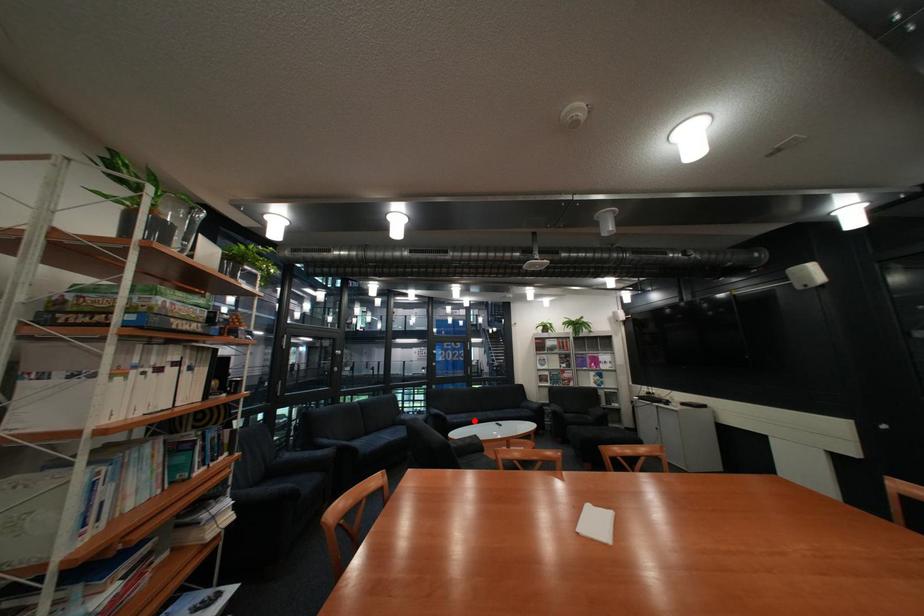
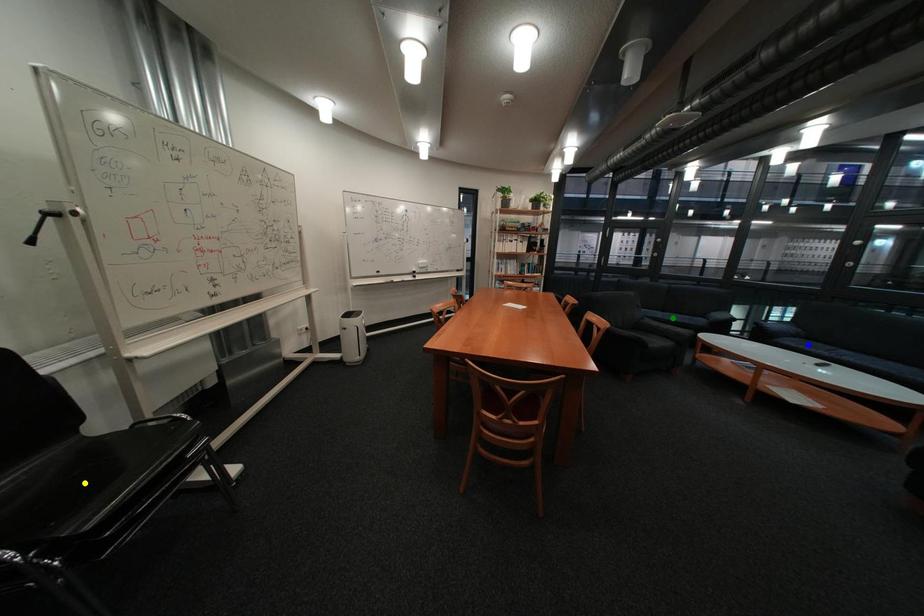
Question: I am providing you with two images of the same scene from different viewpoints. A red point is marked on the first image. You are given multiple points on the second image. Which point in image 2 represents the same 3d spot as the red point in image 1?

Choices:
 (A) yellow point
 (B) blue point
 (C) green point

Answer: (B)